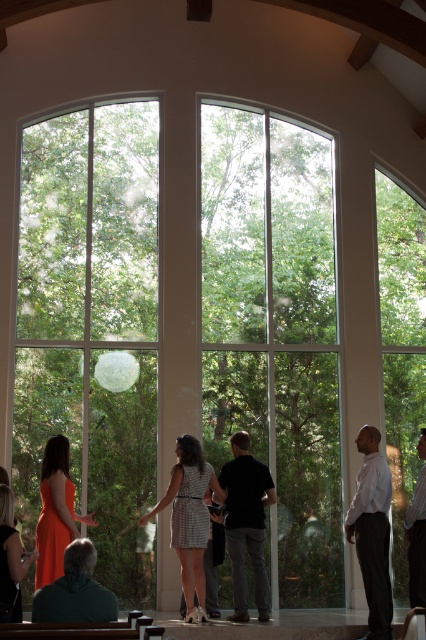
You are standing in the room and want to look outside through the clear glass window at center. Can you see the black matte shirt at center through the window?

The clear glass window at center is above the black matte shirt at center, so you can see the black matte shirt at center through the window because it is positioned below the window.

You are standing in the room and want to take a photo of both the point at coordinates point (405, 326) and the point at coordinates point (2, 492). Which point will appear closer to the camera in the photo?

Point (2, 492) will appear closer to the camera in the photo because it is physically closer to the camera than point (405, 326), which is further away.

You are standing in the room and want to look outside through the clear glass window at center. According to the coordinates provided, where should you position yourself to have the best view?

The clear glass window at center is located at point (275, 333), so you should position yourself at those coordinates to have the best view.